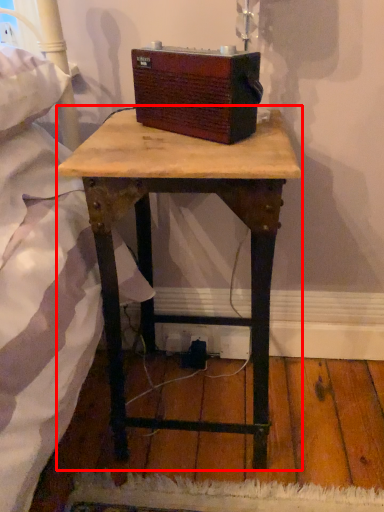
Question: Observing the image, what is the correct spatial positioning of table (annotated by the red box) in reference to box?

Choices:
 (A) left
 (B) right

Answer: (A)